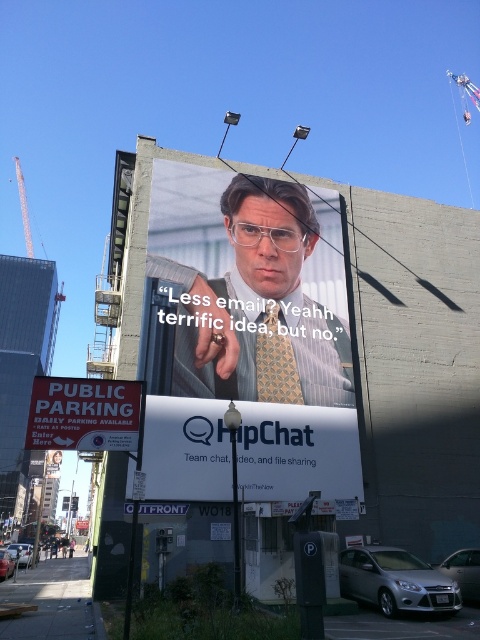
Between white paper at center and patterned silk tie at center, which one is positioned lower?

white paper at center

Between white paper at center and patterned silk tie at center, which one appears on the left side from the viewer's perspective?

Positioned to the left is patterned silk tie at center.

Which is in front, point (247, 452) or point (280, 362)?

Point (247, 452) is in front.

You are a GUI agent. You are given a task and a screenshot of the screen. Output one action in this format:
    pyautogui.click(x=<x>, y=<y>)
    Task: Click on the white paper at center
    
    Given the screenshot: What is the action you would take?
    (298, 451)

Looking at this image, which is more to the right, matte yellow tie at center or patterned silk tie at center?

patterned silk tie at center is more to the right.

Describe the element at coordinates (260, 308) in the screenshot. I see `matte yellow tie at center` at that location.

Where is `matte yellow tie at center`? The height and width of the screenshot is (640, 480). matte yellow tie at center is located at coordinates (260, 308).

The width and height of the screenshot is (480, 640). What do you see at coordinates (260, 308) in the screenshot? I see `matte yellow tie at center` at bounding box center [260, 308].

Does matte yellow tie at center have a smaller size compared to red signboard at lower left?

No.

Is point (251, 182) positioned after point (127, 396)?

Yes, it is behind point (127, 396).

You are a GUI agent. You are given a task and a screenshot of the screen. Output one action in this format:
    pyautogui.click(x=<x>, y=<y>)
    Task: Click on the matte yellow tie at center
    The height and width of the screenshot is (640, 480).
    Given the screenshot: What is the action you would take?
    pyautogui.click(x=260, y=308)